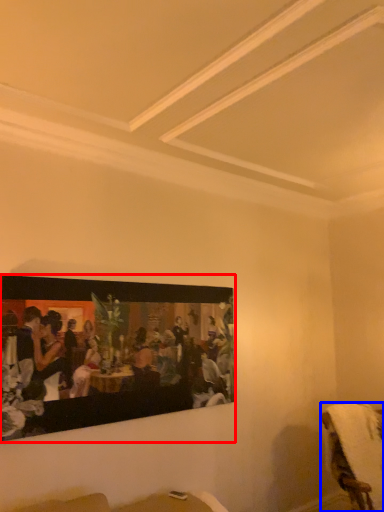
Question: Which object is closer to the camera taking this photo, picture frame (highlighted by a red box) or furniture (highlighted by a blue box)?

Choices:
 (A) picture frame
 (B) furniture

Answer: (A)